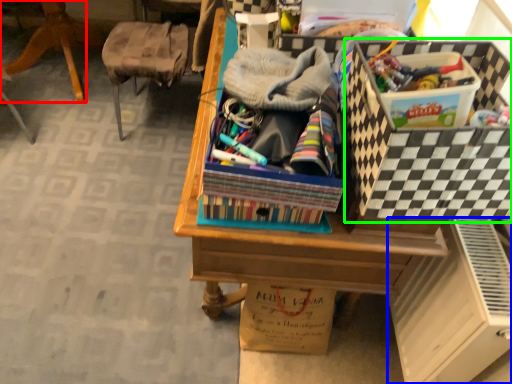
Question: Which object is the closest to the furniture (highlighted by a red box)? Choose among these: file cabinet (highlighted by a blue box) or storage box (highlighted by a green box).

Choices:
 (A) file cabinet
 (B) storage box

Answer: (B)